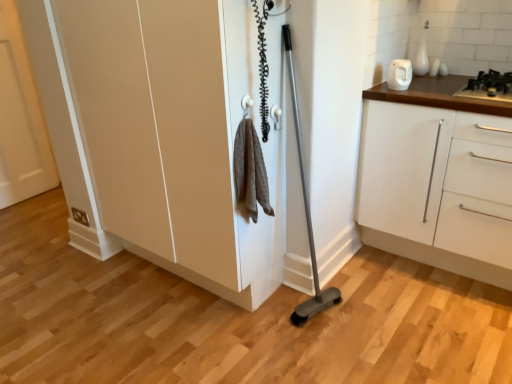
Where is `unoccupied area in front of white glossy kettle at upper right`? The height and width of the screenshot is (384, 512). unoccupied area in front of white glossy kettle at upper right is located at coordinates (411, 100).